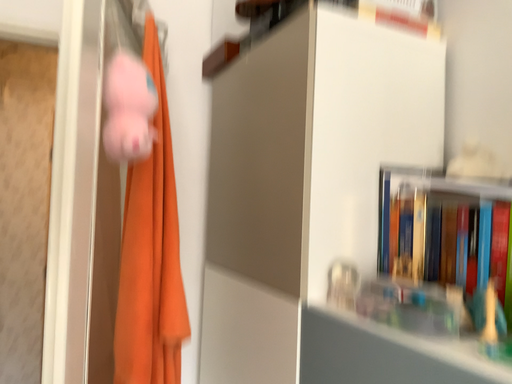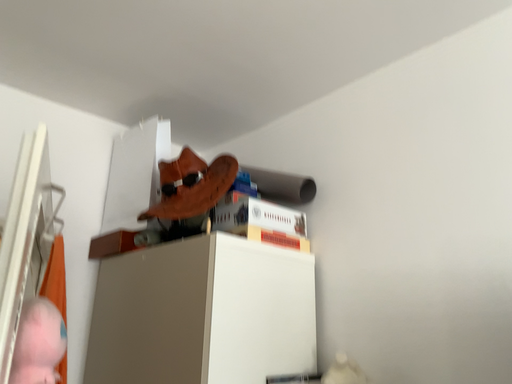
Question: How did the camera likely rotate when shooting the video?

Choices:
 (A) rotated right
 (B) rotated left

Answer: (A)